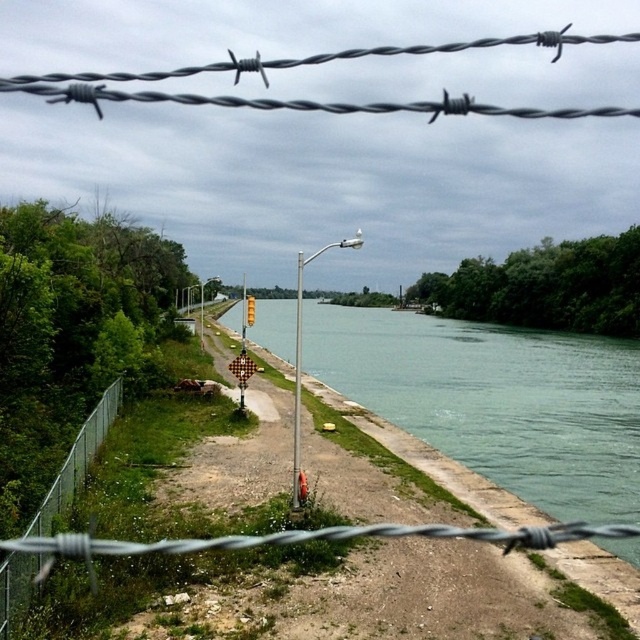
You are standing at the barbed wire fence in the foreground of the canal scene. You see two points marked on the path beyond the fence. Which point is closer to you, point (x=429, y=397) or point (x=26, y=592)?

Point (x=429, y=397) is closer to you because it is further to the viewer than point (x=26, y=592).

You are a delivery drone that needs to fly over the green concrete river at center and the barbed wire at center. Based on the scene, which object is higher from the ground?

The green concrete river at center is above the barbed wire at center, so the green concrete river at center is higher from the ground than the barbed wire at center.